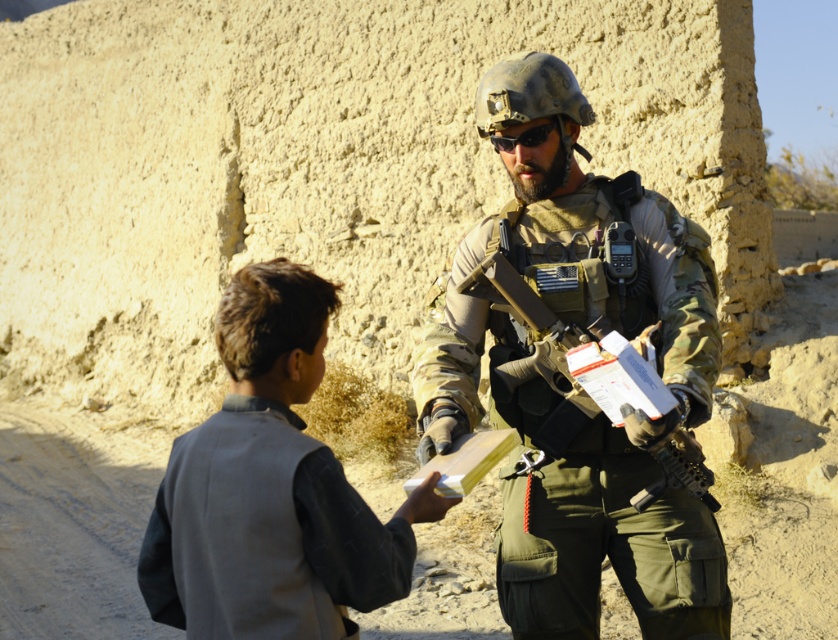
You are a drone operator trying to locate a specific point in an image. The point is at coordinates point (573,380). According to the scene description, what object is located at that point?

The point (573,380) corresponds to the camouflage uniform at center.

Based on the scene description, which object is wider, the camouflage uniform at center or the matte black goggles at center?

The camouflage uniform at center is wider than the matte black goggles at center according to the description.